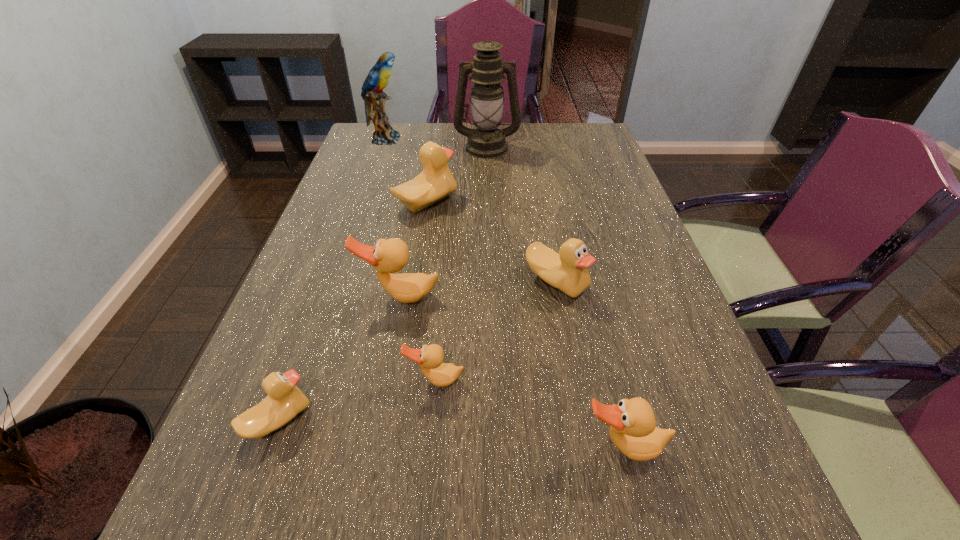
Identify which object is located as the fourth nearest to the farthest tan duck. Please provide its 2D coordinates. Your answer should be formatted as a tuple, i.e. [(x, y)], where the tuple contains the x and y coordinates of a point satisfying the conditions above.

[(436, 182)]

Image resolution: width=960 pixels, height=540 pixels. In order to click on object that is the third closest to the biggest tan duck in this screenshot , I will do `click(285, 400)`.

Find the location of a particular element. duck that stands as the third closest to the oil lamp is located at coordinates (388, 256).

Locate an element on the screen. This screenshot has height=540, width=960. duck that can be found as the fifth closest to the parrot is located at coordinates click(285, 400).

Identify which beige duck is the nearest to the second smallest beige duck. Please provide its 2D coordinates. Your answer should be formatted as a tuple, i.e. [(x, y)], where the tuple contains the x and y coordinates of a point satisfying the conditions above.

[(436, 182)]

Choose which beige duck is the nearest neighbor to the leftmost beige duck. Please provide its 2D coordinates. Your answer should be formatted as a tuple, i.e. [(x, y)], where the tuple contains the x and y coordinates of a point satisfying the conditions above.

[(567, 271)]

Locate an element on the screen. tan duck object that ranks as the closest to the oil lamp is located at coordinates (388, 256).

Select which tan duck appears as the second closest to the second tallest object. Please provide its 2D coordinates. Your answer should be formatted as a tuple, i.e. [(x, y)], where the tuple contains the x and y coordinates of a point satisfying the conditions above.

[(430, 358)]

Where is `vacant space that satisfies the following two spatial constraints: 1. at the beak of the second beige duck from left to right; 2. on the beak of the biggest tan duck`? vacant space that satisfies the following two spatial constraints: 1. at the beak of the second beige duck from left to right; 2. on the beak of the biggest tan duck is located at coordinates (411, 296).

You are a GUI agent. You are given a task and a screenshot of the screen. Output one action in this format:
    pyautogui.click(x=<x>, y=<y>)
    Task: Click on the vacant area in the image that satisfies the following two spatial constraints: 1. on the beak of the third nearest duck; 2. at the beak of the nearest beige duck
    
    Given the screenshot: What is the action you would take?
    pyautogui.click(x=432, y=420)